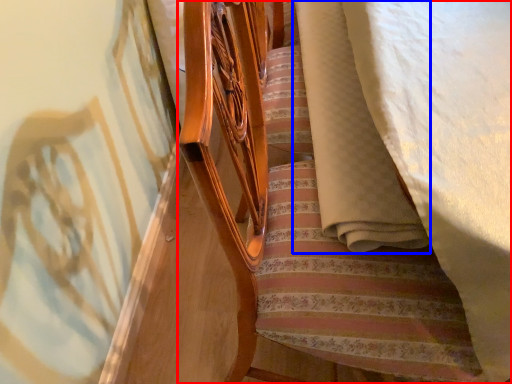
Question: Which object is further to the camera taking this photo, furniture (highlighted by a red box) or blanket (highlighted by a blue box)?

Choices:
 (A) furniture
 (B) blanket

Answer: (B)